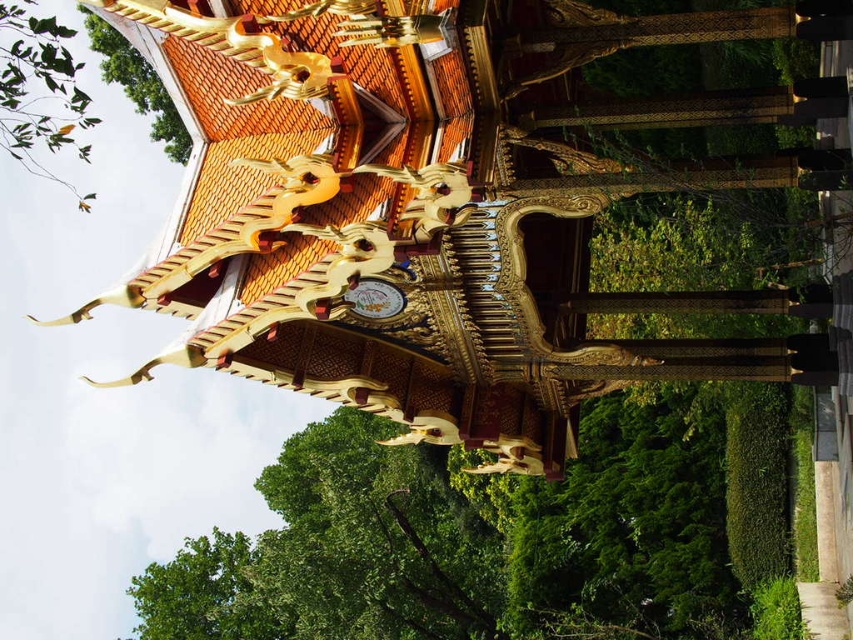
Question: Based on their relative distances, which object is farther from the green leafy branch at upper left?

Choices:
 (A) green leafy tree at upper left
 (B) gold metallic clock at center

Answer: (B)

Question: Is green leafy tree at upper left positioned at the back of gold metallic clock at center?

Choices:
 (A) no
 (B) yes

Answer: (B)

Question: Observing the image, what is the correct spatial positioning of green leafy branch at upper left in reference to gold metallic clock at center?

Choices:
 (A) right
 (B) left

Answer: (B)

Question: Considering the real-world distances, which object is farthest from the gold metallic clock at center?

Choices:
 (A) green leafy tree at upper left
 (B) green leafy branch at upper left

Answer: (A)

Question: Which of the following is the closest to the observer?

Choices:
 (A) (177, 161)
 (B) (402, 298)

Answer: (B)

Question: Is green leafy tree at upper left bigger than gold metallic clock at center?

Choices:
 (A) no
 (B) yes

Answer: (B)